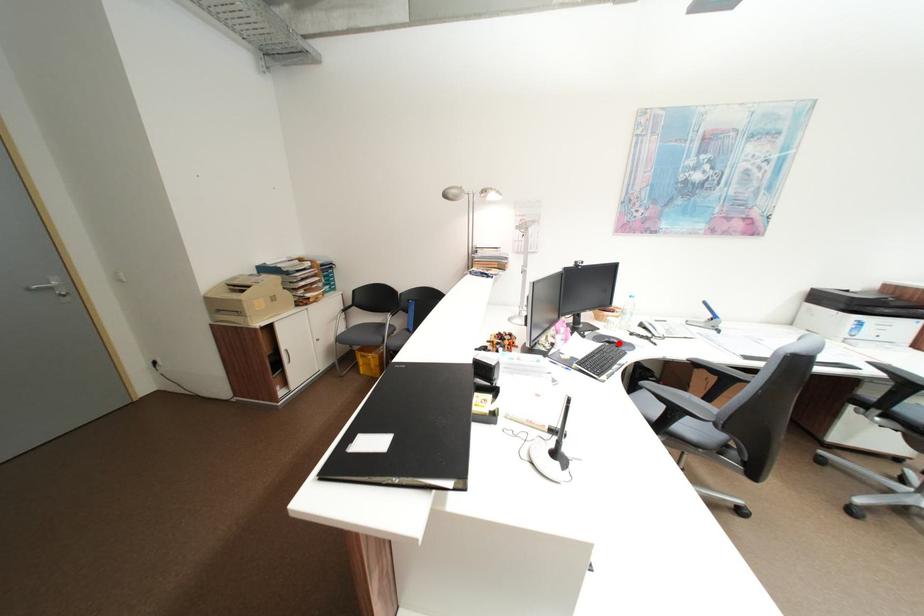
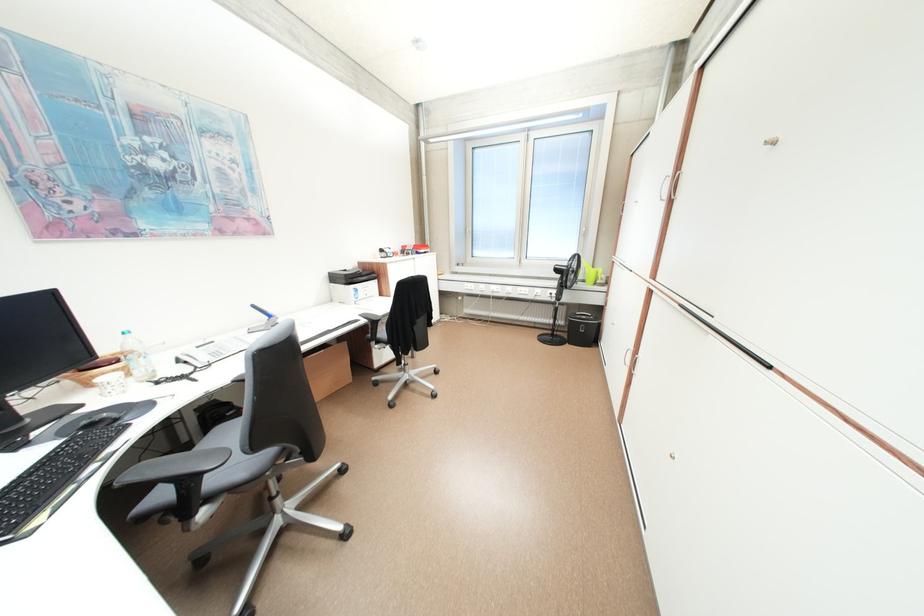
In the second image, find the point that corresponds to the highlighted location in the first image.

(101, 426)